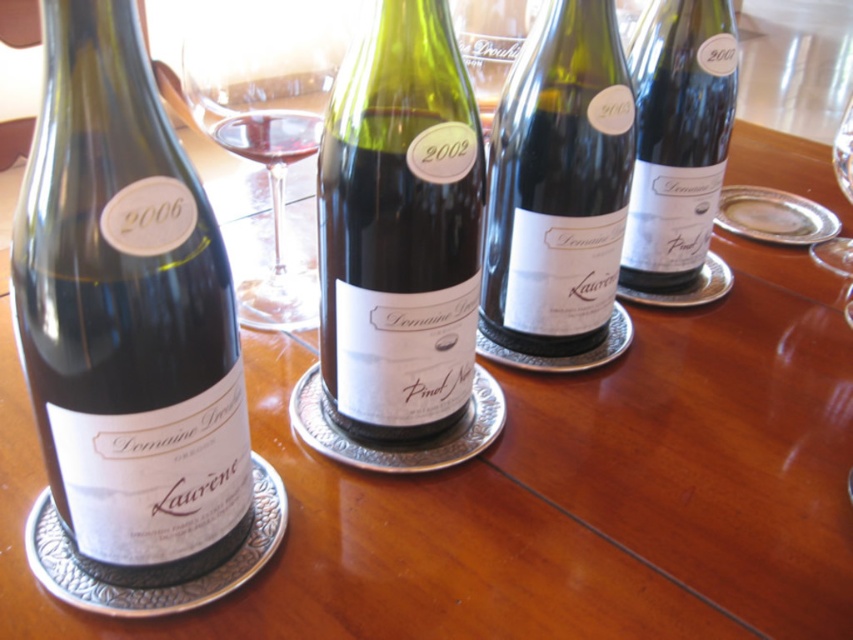
You are a sommelier arranging a wine tasting event. You have a matte black wine bottle at upper right and a transparent glass at upper right on the table. The guests want to pour the wine from the bottle into the glass without spilling. What is the minimum distance you should maintain between the bottle and the glass to ensure the pour is safe?

The minimum distance between the matte black wine bottle at upper right and the transparent glass at upper right should be at least 7.39 inches to ensure safe pouring without spilling.